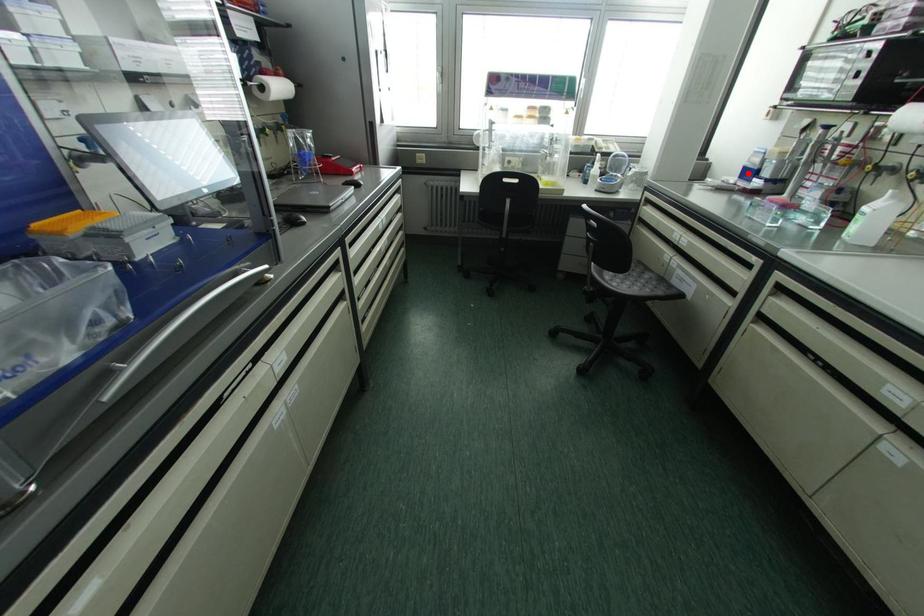
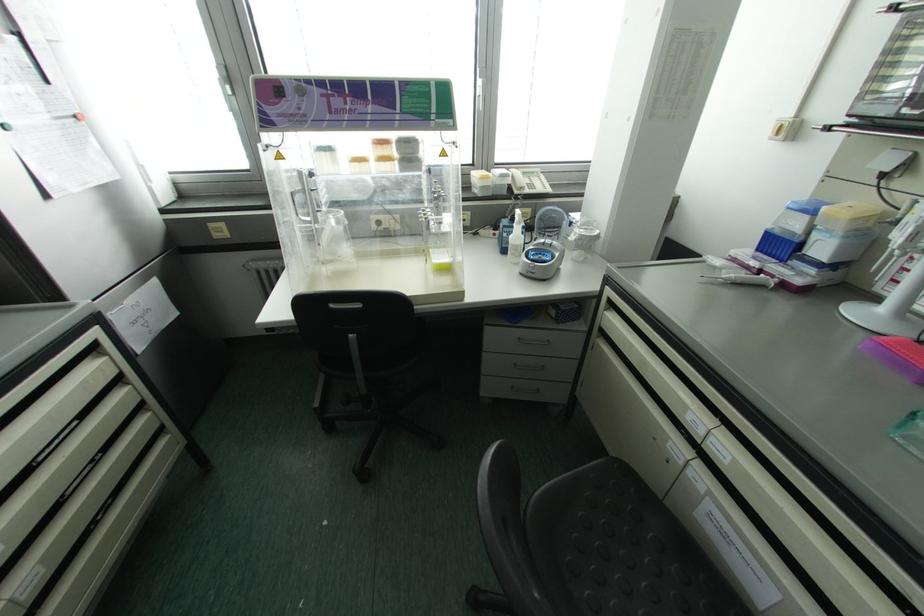
In the second image, find the point that corresponds to the highlighted location in the first image.

(777, 245)